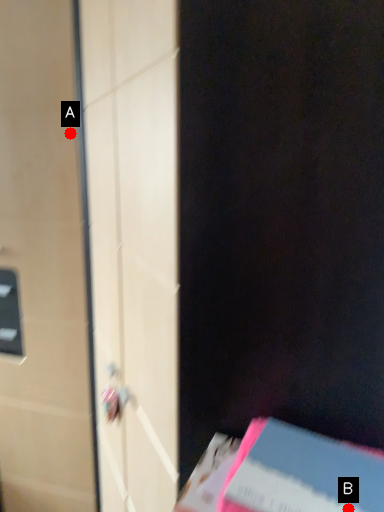
Question: Two points are circled on the image, labeled by A and B beside each circle. Which point appears closest to the camera in this image?

Choices:
 (A) A is closer
 (B) B is closer

Answer: (B)